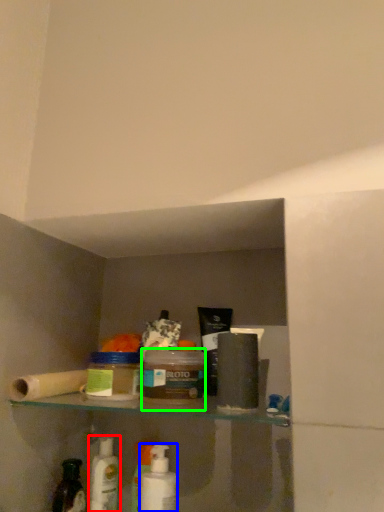
Question: Which object is the farthest from mouthwash (highlighted by a red box)? Choose among these: mouthwash (highlighted by a blue box) or product (highlighted by a green box).

Choices:
 (A) mouthwash
 (B) product

Answer: (B)